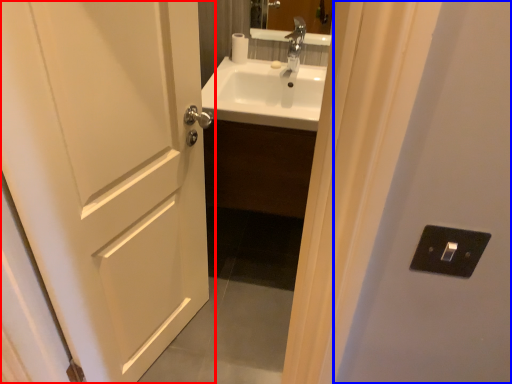
Question: Which point is closer to the camera, door (highlighted by a red box) or screen door (highlighted by a blue box)?

Choices:
 (A) door
 (B) screen door

Answer: (B)